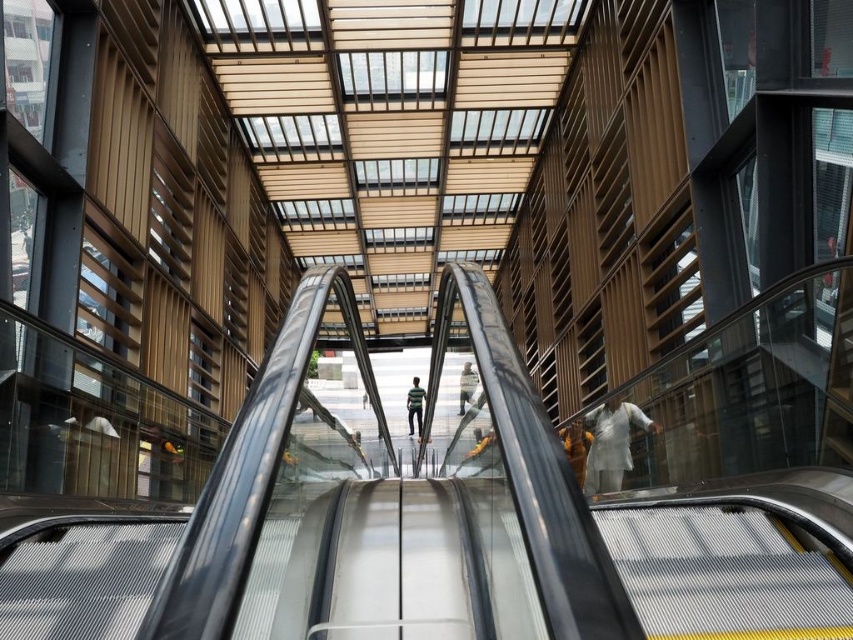
Can you confirm if white cloth at right is shorter than brown leather jacket at center?

Incorrect, white cloth at right's height does not fall short of brown leather jacket at center's.

Which is below, white cloth at right or brown leather jacket at center?

brown leather jacket at center is below.

This screenshot has width=853, height=640. What do you see at coordinates (611, 444) in the screenshot?
I see `white cloth at right` at bounding box center [611, 444].

Identify the location of white cloth at right. The image size is (853, 640). (611, 444).

Can you confirm if striped shirt at center is positioned to the left of light brown leather jacket at center?

Indeed, striped shirt at center is positioned on the left side of light brown leather jacket at center.

Who is positioned more to the left, striped shirt at center or light brown leather jacket at center?

striped shirt at center

What do you see at coordinates (415, 406) in the screenshot?
I see `striped shirt at center` at bounding box center [415, 406].

Locate an element on the screen. This screenshot has height=640, width=853. striped shirt at center is located at coordinates (415, 406).

Does white cloth at right have a smaller size compared to light brown leather jacket at center?

No.

Does point (635, 417) come farther from viewer compared to point (469, 365)?

Yes, it is.

You are a GUI agent. You are given a task and a screenshot of the screen. Output one action in this format:
    pyautogui.click(x=<x>, y=<y>)
    Task: Click on the white cloth at right
    
    Given the screenshot: What is the action you would take?
    pyautogui.click(x=611, y=444)